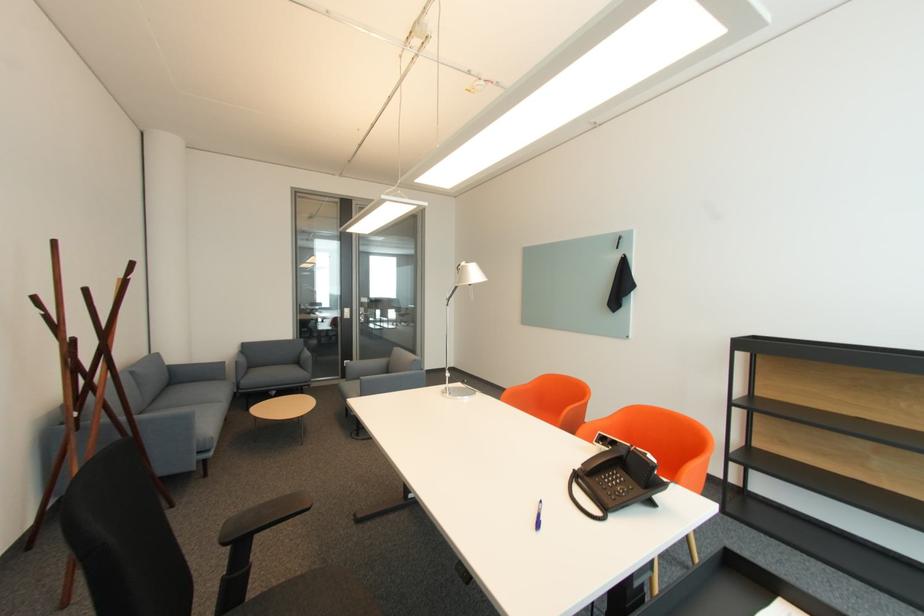
Locate an element on the screen. orange chair sitting surface is located at coordinates (543, 408).